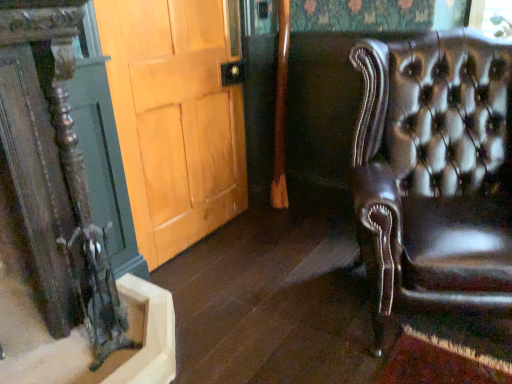
Describe the element at coordinates (435, 172) in the screenshot. I see `brown leather chair at right` at that location.

You are a GUI agent. You are given a task and a screenshot of the screen. Output one action in this format:
    pyautogui.click(x=<x>, y=<y>)
    Task: Click on the brown leather chair at right
    This screenshot has width=512, height=384.
    Given the screenshot: What is the action you would take?
    pyautogui.click(x=435, y=172)

What is the approximate width of light brown wood door at center?

light brown wood door at center is 4.96 inches wide.

This screenshot has height=384, width=512. I want to click on light brown wood door at center, so click(x=176, y=117).

Describe the element at coordinates (176, 117) in the screenshot. This screenshot has height=384, width=512. I see `light brown wood door at center` at that location.

The height and width of the screenshot is (384, 512). What are the coordinates of `brown leather chair at right` in the screenshot? It's located at (435, 172).

Which is more to the left, brown leather chair at right or light brown wood door at center?

From the viewer's perspective, light brown wood door at center appears more on the left side.

Is the depth of brown leather chair at right less than that of light brown wood door at center?

Yes, brown leather chair at right is in front of light brown wood door at center.

Between point (424, 298) and point (188, 10), which one is positioned in front?

The point (424, 298) is in front.

From the image's perspective, which one is positioned lower, brown leather chair at right or light brown wood door at center?

brown leather chair at right appears lower in the image.

From a real-world perspective, does brown leather chair at right stand above light brown wood door at center?

No, from a real-world perspective, brown leather chair at right is not above light brown wood door at center.

Looking at their sizes, would you say brown leather chair at right is wider or thinner than light brown wood door at center?

In the image, brown leather chair at right appears to be wider than light brown wood door at center.

Does brown leather chair at right have a lesser height compared to light brown wood door at center?

Yes.

Considering the sizes of objects brown leather chair at right and light brown wood door at center in the image provided, who is bigger, brown leather chair at right or light brown wood door at center?

With larger size is brown leather chair at right.

Is brown leather chair at right inside the boundaries of light brown wood door at center, or outside?

brown leather chair at right is not enclosed by light brown wood door at center.

Is brown leather chair at right next to light brown wood door at center?

No, brown leather chair at right is not next to light brown wood door at center.

Does brown leather chair at right turn towards light brown wood door at center?

No, brown leather chair at right is not facing towards light brown wood door at center.

How different are the orientations of brown leather chair at right and light brown wood door at center in degrees?

61.8 degrees.

At what (x,y) coordinates should I click in order to perform the action: click on door behind the brown leather chair at right. Please return your answer as a coordinate pair (x, y). The image size is (512, 384). Looking at the image, I should click on pos(176,117).

Looking at this image, is light brown wood door at center at the right side of brown leather chair at right?

Incorrect, light brown wood door at center is not on the right side of brown leather chair at right.

Which object is closer to the camera taking this photo, light brown wood door at center or brown leather chair at right?

brown leather chair at right is closer to the camera.

Does point (215, 139) come behind point (380, 149)?

Yes, point (215, 139) is farther from viewer.

From the image's perspective, would you say light brown wood door at center is shown under brown leather chair at right?

Incorrect, from the image's perspective, light brown wood door at center is higher than brown leather chair at right.

From a real-world perspective, who is located lower, light brown wood door at center or brown leather chair at right?

In real-world perspective, brown leather chair at right is lower.

Which of these two, light brown wood door at center or brown leather chair at right, is wider?

With larger width is brown leather chair at right.

Who is taller, light brown wood door at center or brown leather chair at right?

light brown wood door at center is taller.

Can you confirm if light brown wood door at center is bigger than brown leather chair at right?

No.

Which is correct: light brown wood door at center is inside brown leather chair at right, or outside of it?

light brown wood door at center lies outside brown leather chair at right.

Is light brown wood door at center next to brown leather chair at right?

light brown wood door at center and brown leather chair at right are clearly separated.

Is light brown wood door at center aimed at brown leather chair at right?

Yes, light brown wood door at center is oriented towards brown leather chair at right.

How much distance is there between light brown wood door at center and brown leather chair at right?

1.00 meters.

At what (x,y) coordinates should I click in order to perform the action: click on door on the left of brown leather chair at right. Please return your answer as a coordinate pair (x, y). The height and width of the screenshot is (384, 512). Looking at the image, I should click on (176, 117).

This screenshot has width=512, height=384. I want to click on chair on the right of the light brown wood door at center, so click(x=435, y=172).

Identify the location of chair below the light brown wood door at center (from the image's perspective). pos(435,172).